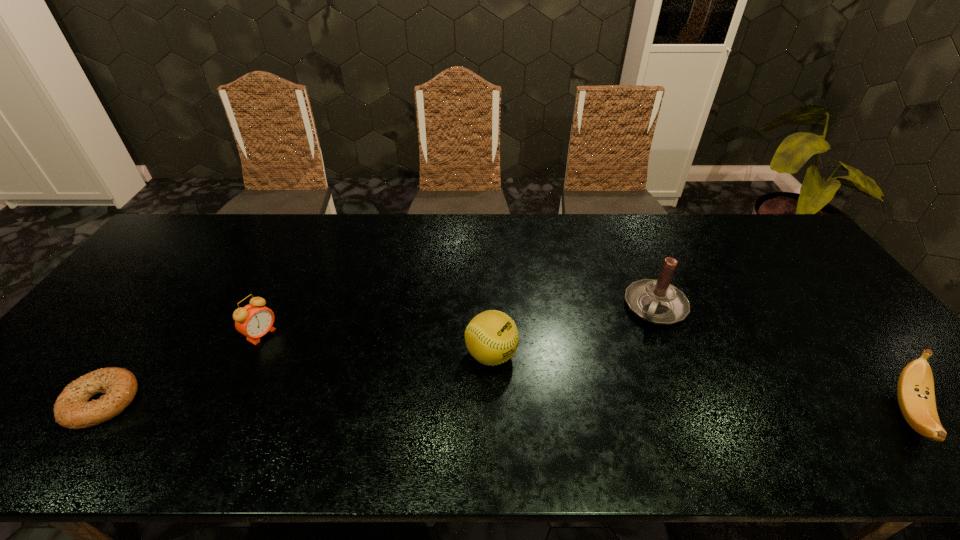
This screenshot has height=540, width=960. Identify the location of vacant area at the near edge of the desktop. (678, 417).

The width and height of the screenshot is (960, 540). What are the coordinates of `vacant space at the left edge of the desktop` in the screenshot? It's located at click(143, 300).

The width and height of the screenshot is (960, 540). I want to click on vacant space at the right edge of the desktop, so click(x=792, y=294).

Where is `blank area at the far left corner`? The height and width of the screenshot is (540, 960). blank area at the far left corner is located at coordinates (196, 214).

The image size is (960, 540). I want to click on free space at the far right corner, so click(x=736, y=225).

I want to click on empty space between the candle and the second object from left to right, so click(459, 321).

Locate an element on the screen. unoccupied area between the alarm clock and the softball is located at coordinates (376, 345).

This screenshot has width=960, height=540. I want to click on vacant space that is in between the leftmost object and the alarm clock, so click(x=181, y=368).

The height and width of the screenshot is (540, 960). In order to click on blank region between the candle and the softball in this screenshot , I will do `click(573, 331)`.

The width and height of the screenshot is (960, 540). I want to click on empty space that is in between the third object from left to right and the shortest object, so click(297, 378).